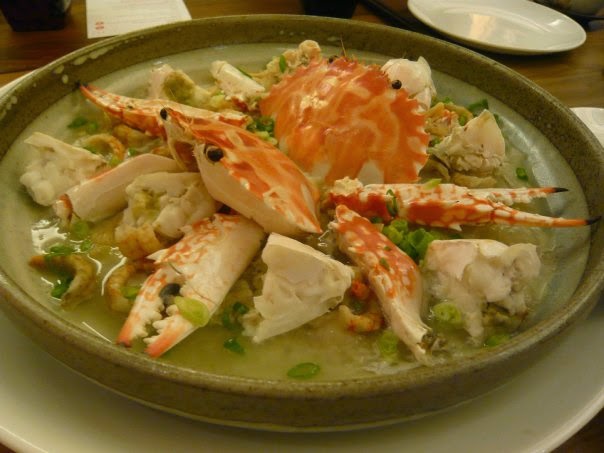
The image size is (604, 453). In order to click on table in this screenshot , I will do `click(598, 440)`.